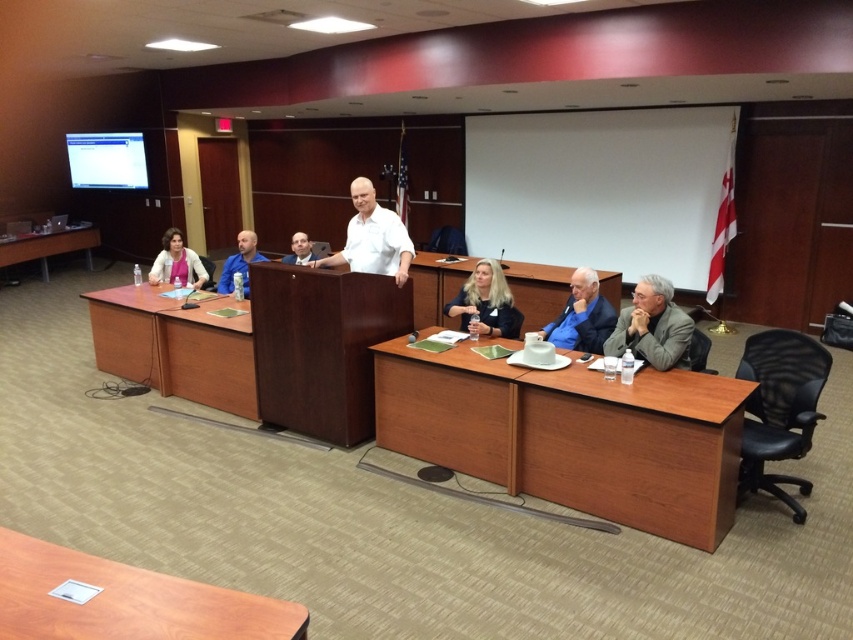
You are an attendee sitting at the U shaped table in the conference room. You need to walk to the point labeled point (654,362). Which direction should you go relative to point (190,256)?

You should walk towards the front of the room since point (654,362) is in front of point (190,256).

You are a photographer positioned at the front of the conference room. You want to take a photo that includes both point (483, 272) and point (589, 349) in the frame. Which point is closer to your camera lens?

Point (589, 349) is closer to the camera lens because it is less further away than point (483, 272), which is further to the camera.

You are standing at the entrance of the conference room and see the point marked at coordinates (572, 435). What object is located at that point?

The point at coordinates (572, 435) marks the cherry wood table at lower center.